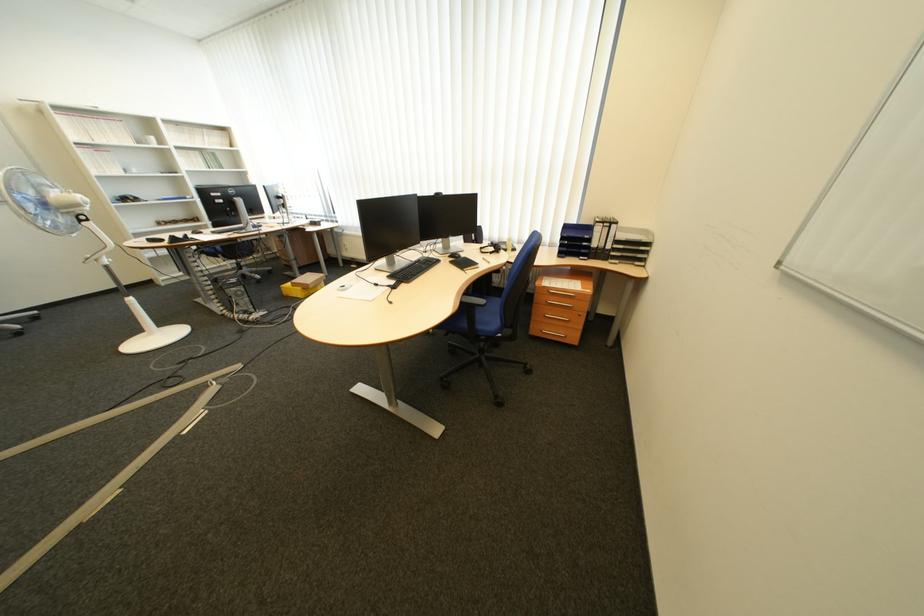
Find the location of a particular element. black chair armrest is located at coordinates (472, 300).